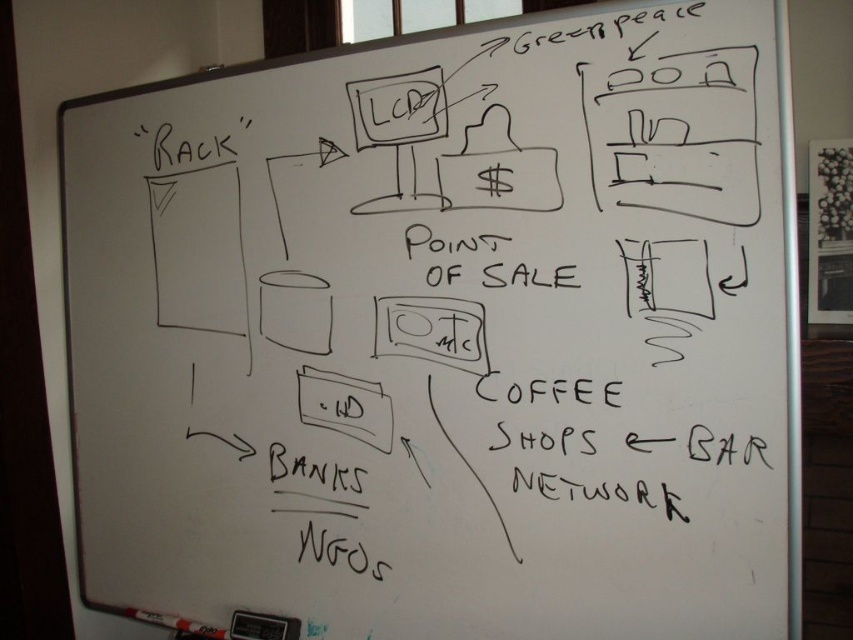
Question: Is white paper at center positioned behind white matte marker at bottom left?

Choices:
 (A) no
 (B) yes

Answer: (A)

Question: In this image, where is white paper at center located relative to white matte marker at bottom left?

Choices:
 (A) below
 (B) above

Answer: (B)

Question: Among these objects, which one is nearest to the camera?

Choices:
 (A) white matte marker at bottom left
 (B) white paper at center

Answer: (B)

Question: Which point is farther to the camera?

Choices:
 (A) white matte marker at bottom left
 (B) white paper at center

Answer: (A)

Question: Can you confirm if white paper at center is positioned to the right of white matte marker at bottom left?

Choices:
 (A) yes
 (B) no

Answer: (A)